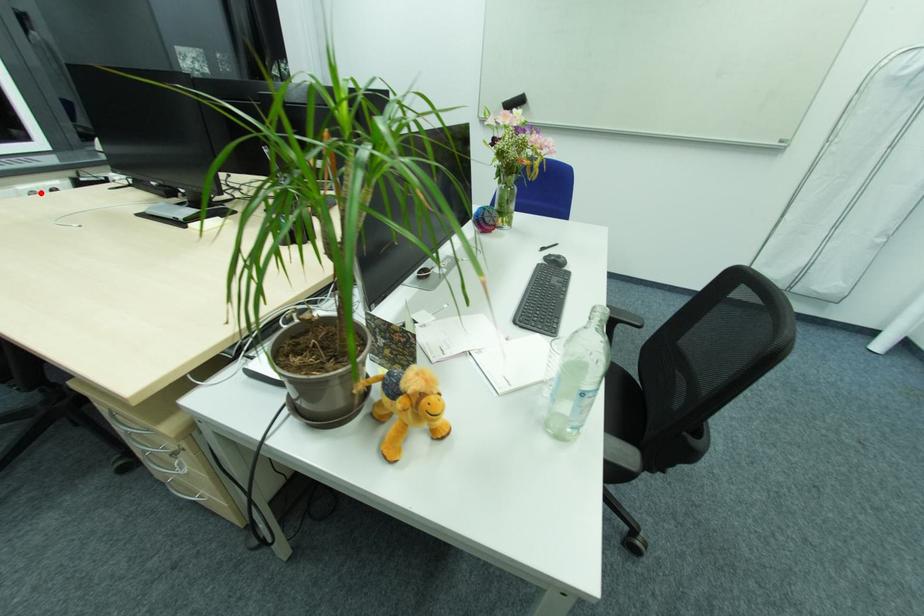
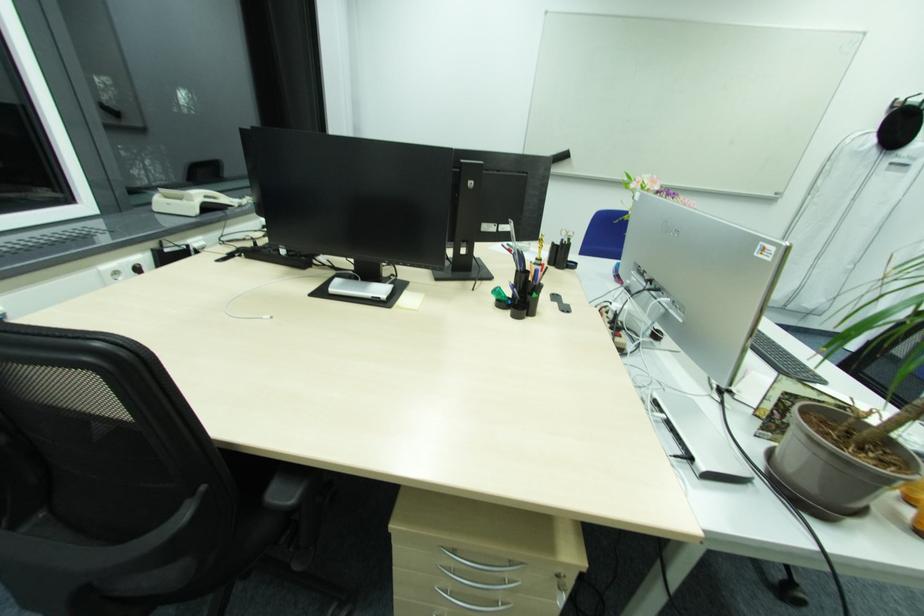
Find the pixel in the second image that matches the highlighted location in the first image.

(120, 272)